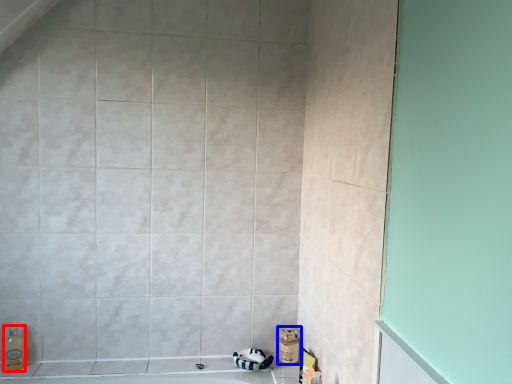
Question: Which point is closer to the camera, soap dispenser (highlighted by a red box) or toiletry (highlighted by a blue box)?

Choices:
 (A) soap dispenser
 (B) toiletry

Answer: (A)